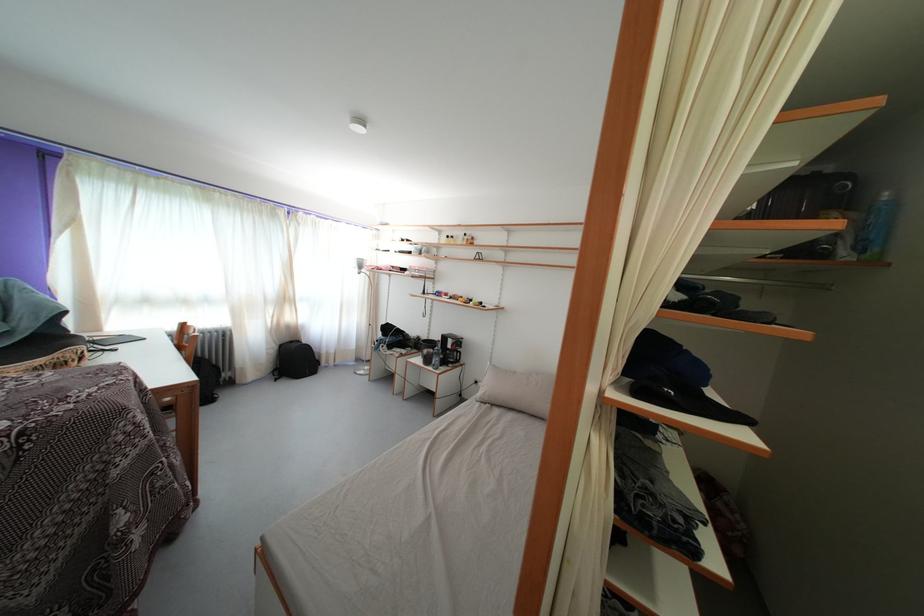
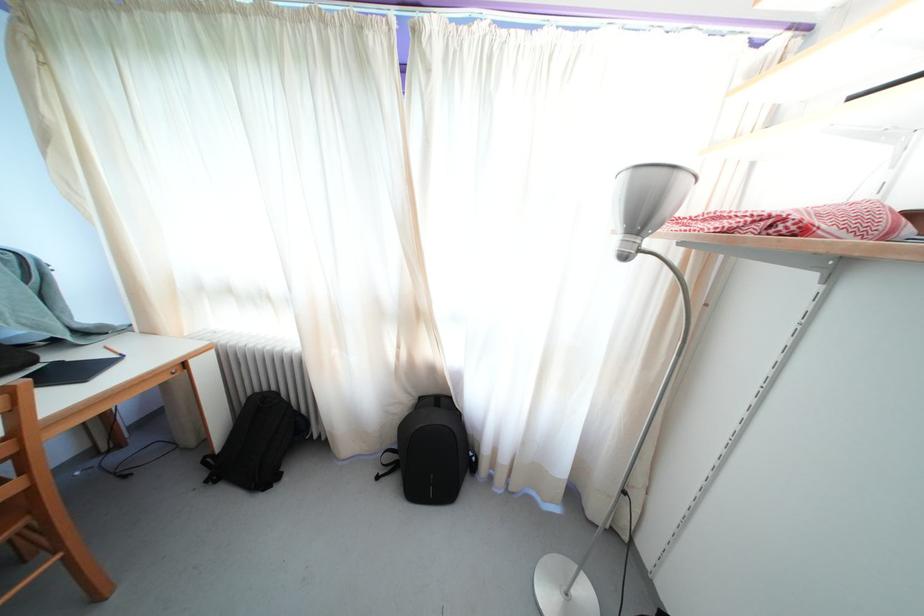
The point at (367, 272) is marked in the first image. Where is the corresponding point in the second image?

(648, 223)